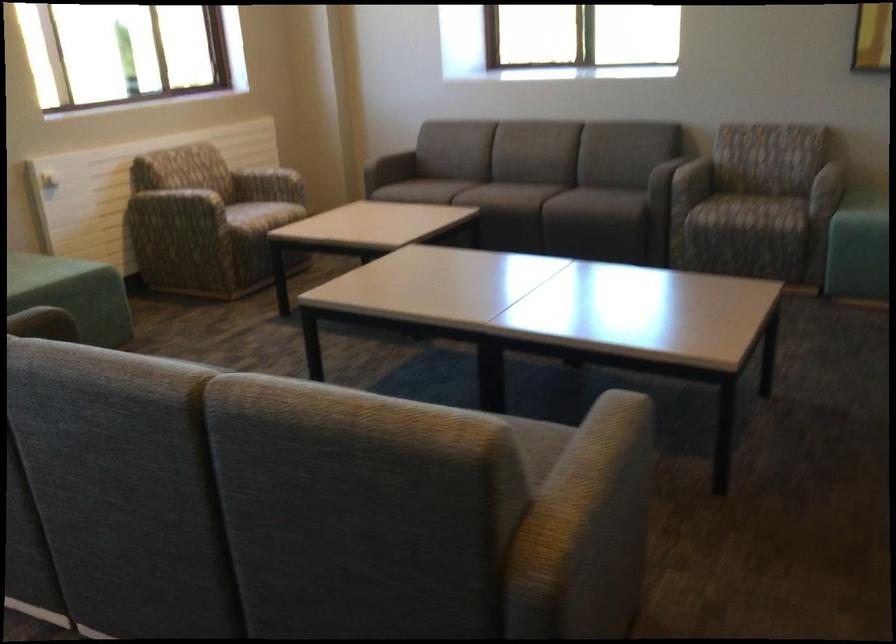
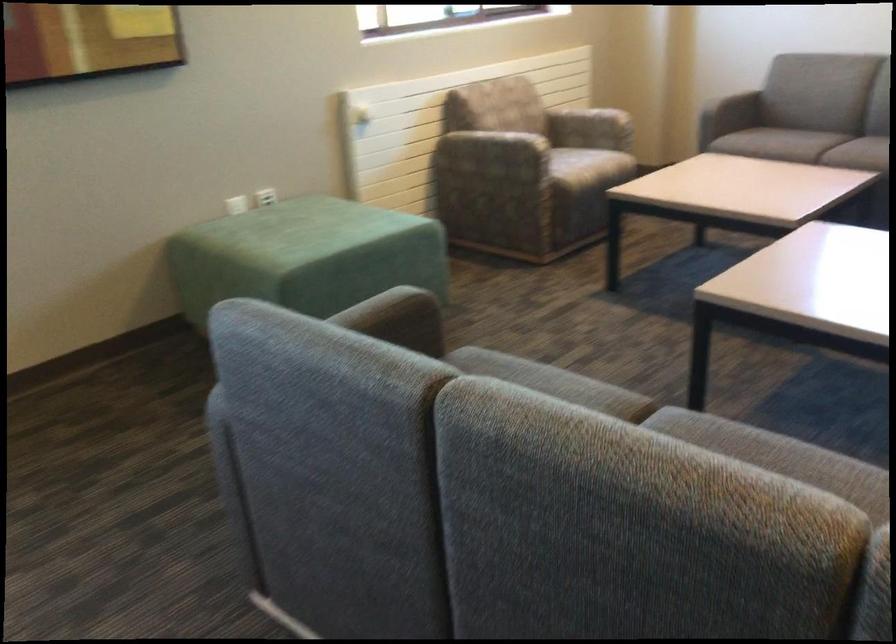
In a continuous first-person perspective shot, in which direction is the camera moving?

The movement direction of the cameraman is left, forward.